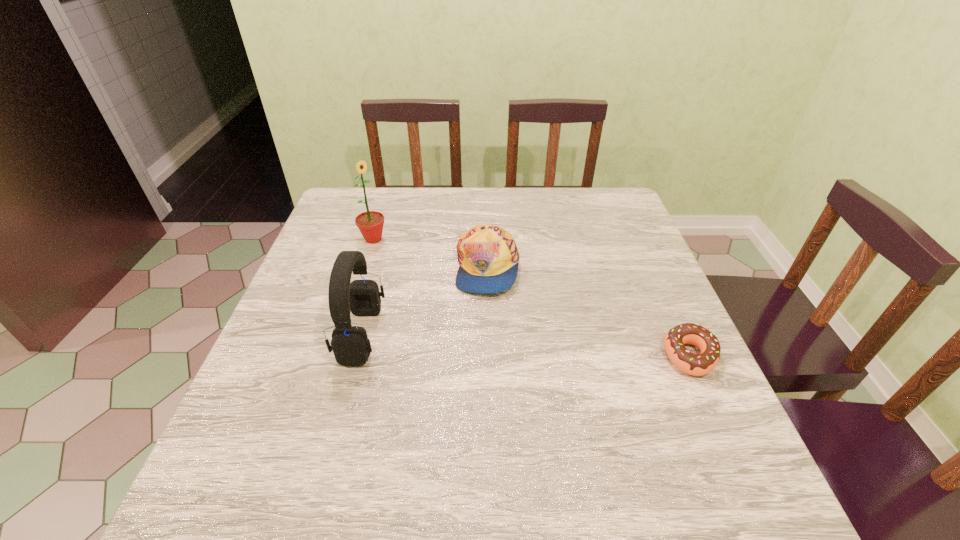
In the image, there is a desktop. Where is `free space at the right edge`? free space at the right edge is located at coordinates (610, 244).

In the image, there is a desktop. At what (x,y) coordinates should I click in order to perform the action: click on vacant region at the far left corner. Please return your answer as a coordinate pair (x, y). This screenshot has height=540, width=960. Looking at the image, I should click on (348, 206).

Where is `vacant space at the near left corner of the desktop`? Image resolution: width=960 pixels, height=540 pixels. vacant space at the near left corner of the desktop is located at coordinates (263, 431).

At what (x,y) coordinates should I click in order to perform the action: click on free space at the far right corner. Please return your answer as a coordinate pair (x, y). This screenshot has width=960, height=540. Looking at the image, I should click on (574, 191).

This screenshot has width=960, height=540. In the image, there is a desktop. What are the coordinates of `vacant region at the near right corner` in the screenshot? It's located at (714, 426).

In order to click on free spot between the tallest object and the second object from right to left in this screenshot , I will do `click(431, 253)`.

Find the location of a particular element. Image resolution: width=960 pixels, height=540 pixels. free area in between the third object from left to right and the headset is located at coordinates click(x=424, y=301).

This screenshot has width=960, height=540. I want to click on empty space that is in between the doughnut and the tallest object, so click(532, 298).

The image size is (960, 540). Find the location of `free space between the cap and the rightmost object`. free space between the cap and the rightmost object is located at coordinates (589, 312).

This screenshot has width=960, height=540. Identify the location of vacant area between the sunflower and the shortest object. (532, 298).